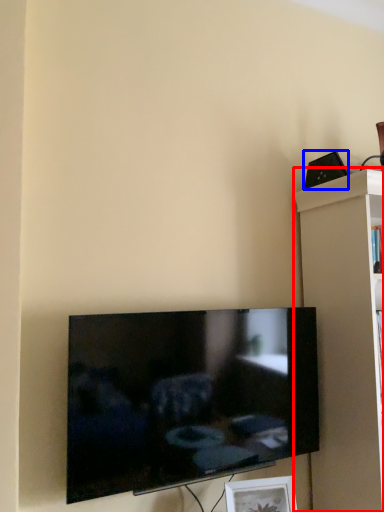
Question: Among these objects, which one is farthest to the camera, shelf (highlighted by a red box) or speaker (highlighted by a blue box)?

Choices:
 (A) shelf
 (B) speaker

Answer: (B)